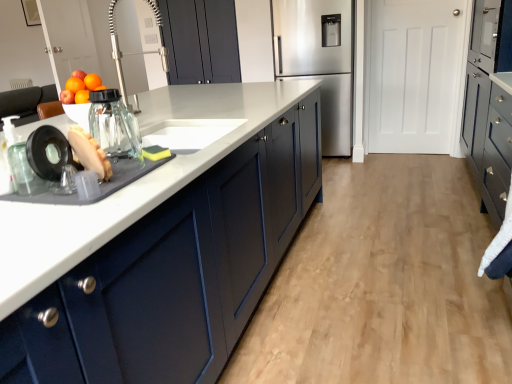
Question: Is yellow sponge at sink, acting as the second food starting from the left, facing away from clear glass jar at sink, which is counted as the second appliance, starting from the left?

Choices:
 (A) no
 (B) yes

Answer: (A)

Question: From a real-world perspective, is yellow sponge at sink, the 2th food viewed from the front, over clear glass jar at sink, which is counted as the second appliance, starting from the left?

Choices:
 (A) no
 (B) yes

Answer: (A)

Question: From a real-world perspective, is yellow sponge at sink, which is the 1th food from back to front, below clear glass jar at sink, which is counted as the second appliance, starting from the left?

Choices:
 (A) yes
 (B) no

Answer: (A)

Question: Is yellow sponge at sink, the 2th food viewed from the front, to the left of clear glass jar at sink, which is counted as the second appliance, starting from the left, from the viewer's perspective?

Choices:
 (A) yes
 (B) no

Answer: (B)

Question: Is yellow sponge at sink, the 2th food viewed from the front, outside clear glass jar at sink, which is counted as the second appliance, starting from the left?

Choices:
 (A) no
 (B) yes

Answer: (B)

Question: Considering the positions of matte blue cabinets at center and matte blue cabinets at center, the 2th cabinetry viewed from the right, in the image, is matte blue cabinets at center wider or thinner than matte blue cabinets at center, the 2th cabinetry viewed from the right,?

Choices:
 (A) wide
 (B) thin

Answer: (A)

Question: From a real-world perspective, is matte blue cabinets at center above or below matte blue cabinets at center, which is the 2th cabinetry from left to right?

Choices:
 (A) below
 (B) above

Answer: (A)

Question: Does point (247, 327) appear closer or farther from the camera than point (88, 370)?

Choices:
 (A) closer
 (B) farther

Answer: (B)

Question: Based on their sizes in the image, would you say matte blue cabinets at center is bigger or smaller than matte blue cabinets at center, which is the 2th cabinetry from left to right?

Choices:
 (A) small
 (B) big

Answer: (A)

Question: Considering the relative positions of shiny glass jar at left and matte dark blue cabinet at right, the third cabinetry when ordered from left to right, in the image provided, is shiny glass jar at left to the left or to the right of matte dark blue cabinet at right, the third cabinetry when ordered from left to right,?

Choices:
 (A) right
 (B) left

Answer: (B)

Question: Looking at the image, does shiny glass jar at left seem bigger or smaller compared to matte dark blue cabinet at right, the third cabinetry when ordered from left to right?

Choices:
 (A) big
 (B) small

Answer: (B)

Question: Is shiny glass jar at left taller or shorter than matte dark blue cabinet at right, positioned as the 1th cabinetry in right-to-left order?

Choices:
 (A) short
 (B) tall

Answer: (A)

Question: From a real-world perspective, is shiny glass jar at left physically located above or below matte dark blue cabinet at right, positioned as the 1th cabinetry in right-to-left order?

Choices:
 (A) above
 (B) below

Answer: (A)

Question: Based on their positions, is brown matte bread at left, which appears as the second food when viewed from the right, located to the left or right of yellow sponge at sink, which is the first food in right-to-left order?

Choices:
 (A) right
 (B) left

Answer: (B)

Question: Based on their sizes in the image, would you say brown matte bread at left, which ranks as the second food in back-to-front order, is bigger or smaller than yellow sponge at sink, which is the first food in right-to-left order?

Choices:
 (A) small
 (B) big

Answer: (B)